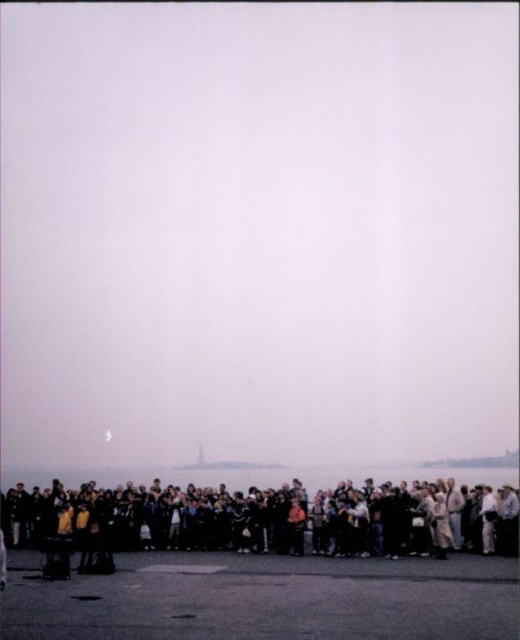
Question: Which point appears closest to the camera in this image?

Choices:
 (A) (221, 531)
 (B) (279, 604)

Answer: (B)

Question: Does dark asphalt tarmac at lower center appear on the left side of dark gray clothing at lower center?

Choices:
 (A) yes
 (B) no

Answer: (B)

Question: Can you confirm if dark asphalt tarmac at lower center is positioned above dark gray clothing at lower center?

Choices:
 (A) no
 (B) yes

Answer: (B)

Question: Which point appears closest to the camera in this image?

Choices:
 (A) (198, 632)
 (B) (390, 484)

Answer: (A)

Question: Is dark asphalt tarmac at lower center further to camera compared to dark gray clothing at lower center?

Choices:
 (A) no
 (B) yes

Answer: (A)